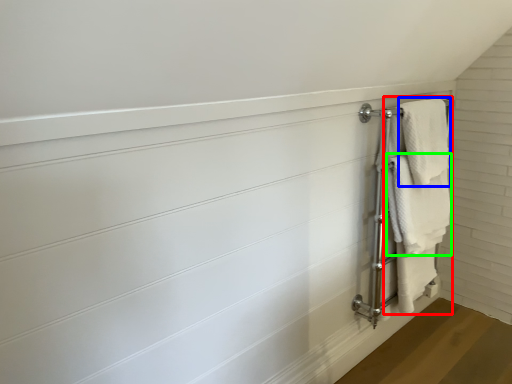
Question: Based on their relative distances, which object is nearer to bath towel (highlighted by a red box)? Choose from bath towel (highlighted by a blue box) and towel (highlighted by a green box).

Choices:
 (A) bath towel
 (B) towel

Answer: (B)